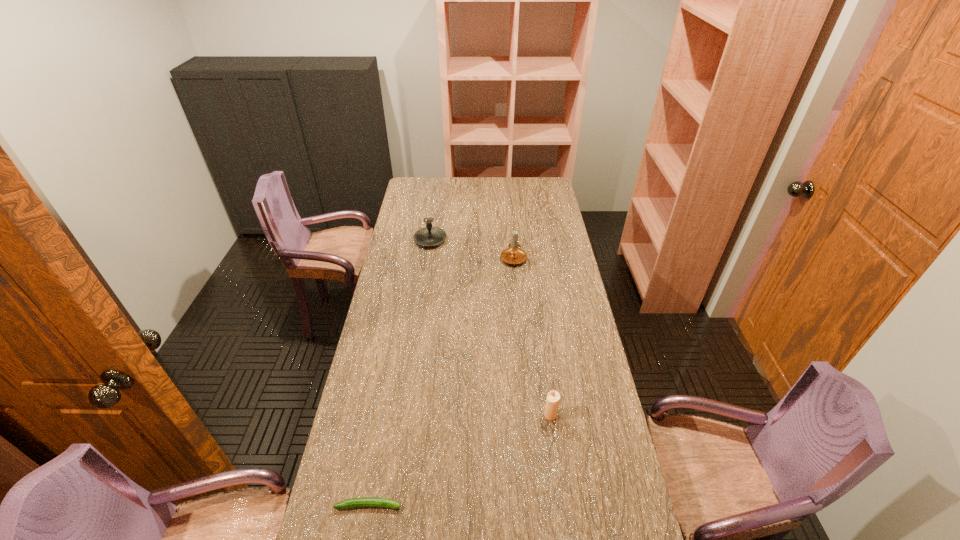
I want to click on the second farthest object, so click(x=513, y=254).

You are a GUI agent. You are given a task and a screenshot of the screen. Output one action in this format:
    pyautogui.click(x=<x>, y=<y>)
    Task: Click on the farthest candle
    
    Given the screenshot: What is the action you would take?
    pyautogui.click(x=429, y=236)

You are a GUI agent. You are given a task and a screenshot of the screen. Output one action in this format:
    pyautogui.click(x=<x>, y=<y>)
    Task: Click on the farthest object
    The width and height of the screenshot is (960, 540).
    Given the screenshot: What is the action you would take?
    pyautogui.click(x=429, y=236)

In order to click on the second shortest object in this screenshot , I will do `click(553, 398)`.

Locate an element on the screen. the shortest candle is located at coordinates (553, 398).

Image resolution: width=960 pixels, height=540 pixels. I want to click on the shortest object, so click(x=363, y=501).

This screenshot has width=960, height=540. Find the location of `the nearest object`. the nearest object is located at coordinates (363, 501).

Where is `free space located 0.140m on the front of the second farthest object`? free space located 0.140m on the front of the second farthest object is located at coordinates (519, 289).

Locate an element on the screen. The height and width of the screenshot is (540, 960). vacant space located 0.190m on the front of the farthest object is located at coordinates (425, 278).

I want to click on vacant space located 0.150m on the right of the shortest candle, so click(606, 415).